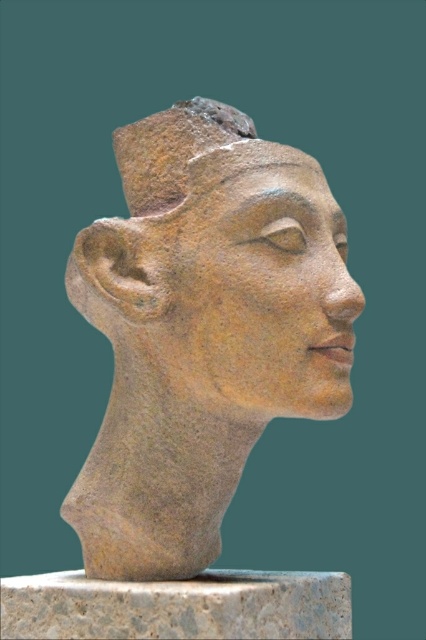
Question: Which object is closer to the camera taking this photo?

Choices:
 (A) granite pedestal at center
 (B) earthenware statue at center

Answer: (A)

Question: Can you confirm if earthenware statue at center is bigger than granite pedestal at center?

Choices:
 (A) yes
 (B) no

Answer: (A)

Question: Which of the following is the farthest from the observer?

Choices:
 (A) click(x=147, y=595)
 (B) click(x=267, y=260)

Answer: (A)

Question: Which of the following is the closest to the observer?

Choices:
 (A) earthenware statue at center
 (B) granite pedestal at center

Answer: (B)

Question: Can you confirm if earthenware statue at center is smaller than granite pedestal at center?

Choices:
 (A) yes
 (B) no

Answer: (B)

Question: Does earthenware statue at center have a smaller size compared to granite pedestal at center?

Choices:
 (A) yes
 (B) no

Answer: (B)